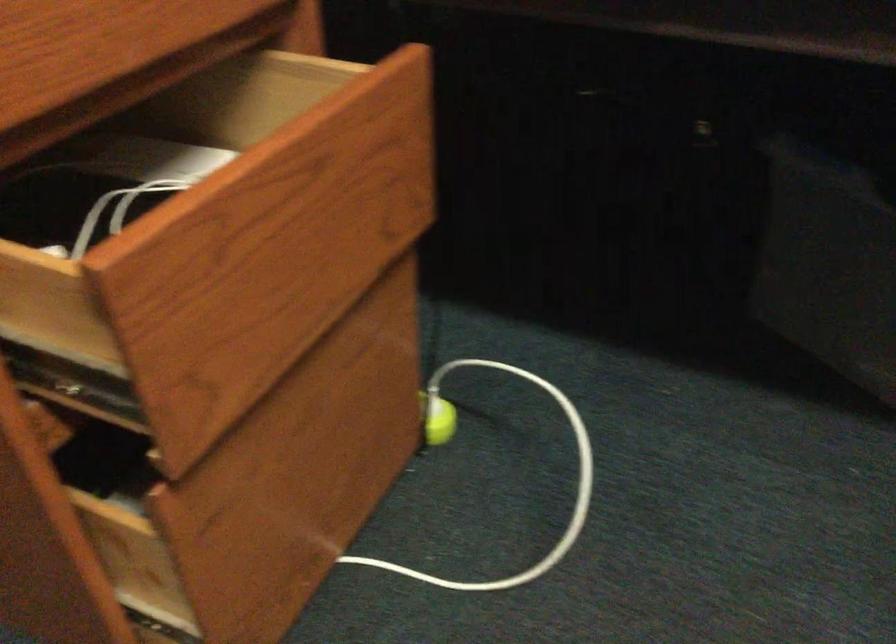
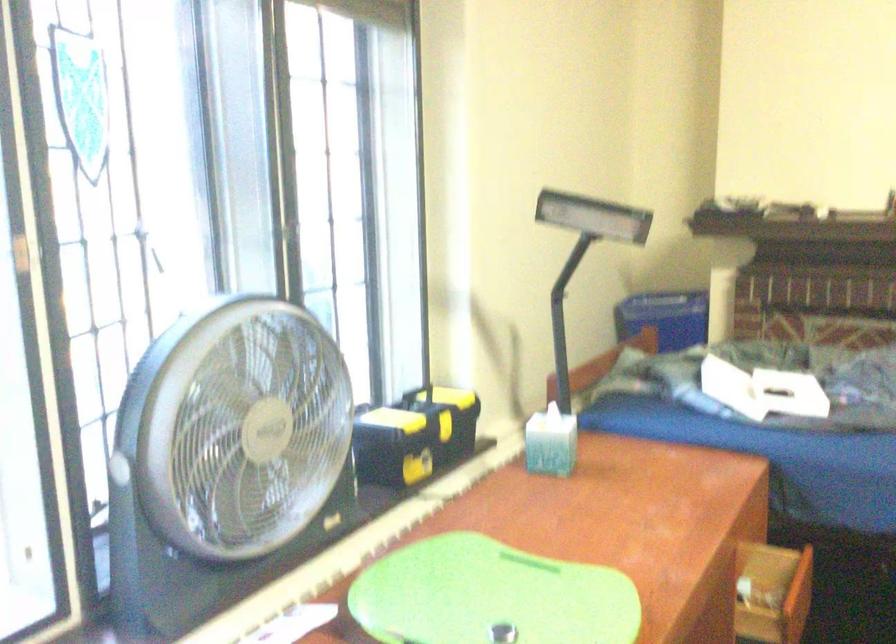
In a continuous first-person perspective shot, in which direction is the camera moving?

The cameraman moved toward left, backward.